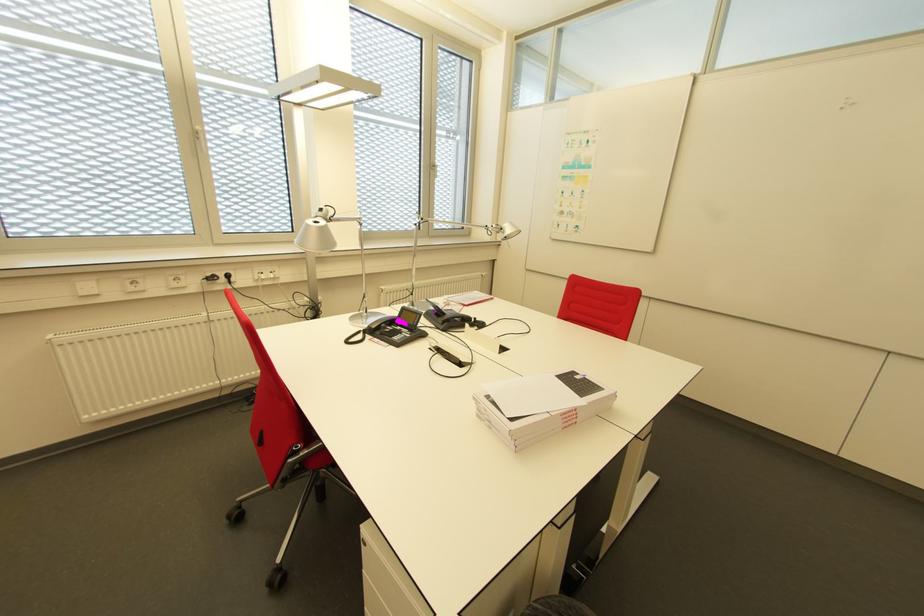
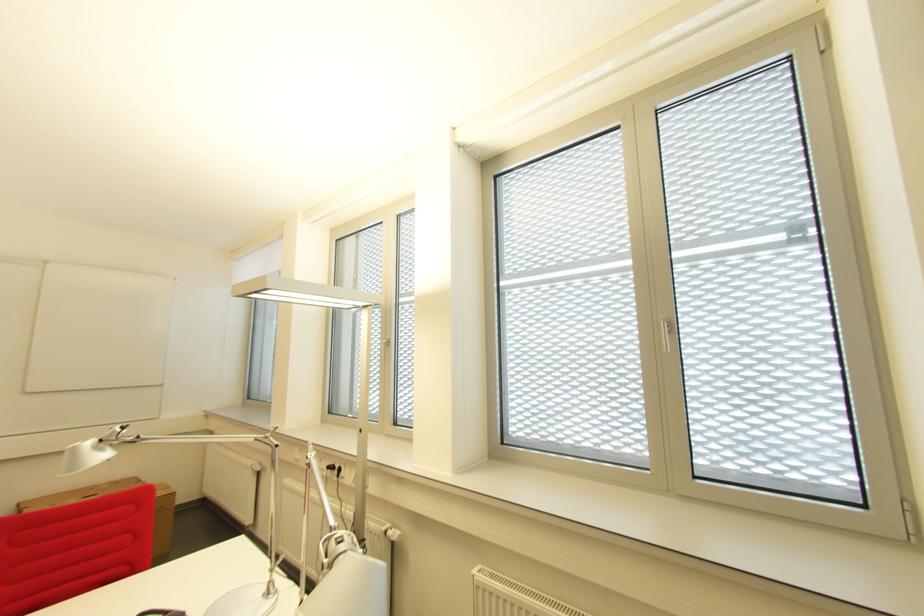
Where in the second image is the point corresponding to [217,280] from the first image?

(337, 469)